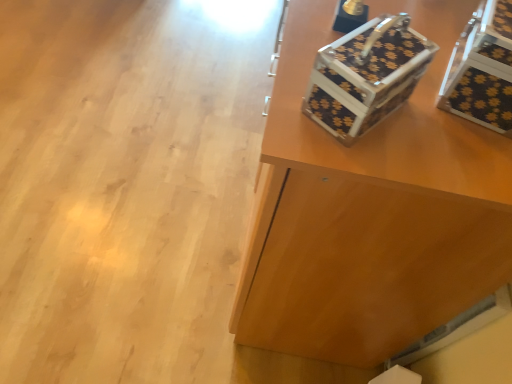
Question: Is black textured suitcase at upper right to the left or to the right of metallic floral-patterned shoe box at upper right in the image?

Choices:
 (A) right
 (B) left

Answer: (A)

Question: Looking at their shapes, would you say black textured suitcase at upper right is wider or thinner than metallic floral-patterned shoe box at upper right?

Choices:
 (A) thin
 (B) wide

Answer: (B)

Question: Estimate the real-world distances between objects in this image. Which object is farther from the black textured suitcase at upper right?

Choices:
 (A) black textured storage box at upper right
 (B) metallic floral-patterned shoe box at upper right

Answer: (A)

Question: Considering the real-world distances, which object is closest to the metallic floral-patterned shoe box at upper right?

Choices:
 (A) black textured storage box at upper right
 (B) black textured suitcase at upper right

Answer: (A)